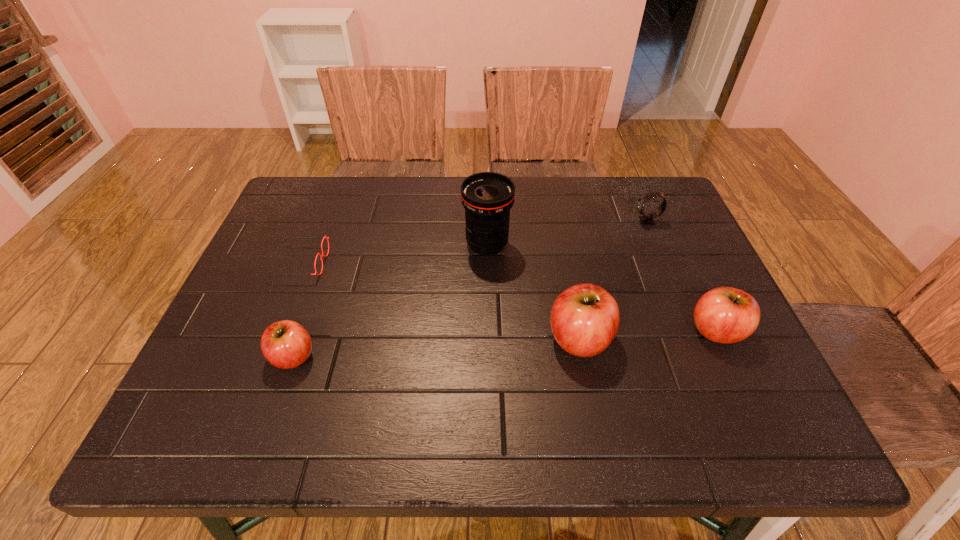
At what (x,y) coordinates should I click in order to perform the action: click on the leftmost apple. Please return your answer as a coordinate pair (x, y). The width and height of the screenshot is (960, 540). Looking at the image, I should click on (286, 344).

Locate an element on the screen. The width and height of the screenshot is (960, 540). the second apple from left to right is located at coordinates 584,320.

Identify the location of the tallest apple. [x=584, y=320].

You are a GUI agent. You are given a task and a screenshot of the screen. Output one action in this format:
    pyautogui.click(x=<x>, y=<y>)
    Task: Click on the second tallest apple
    
    Given the screenshot: What is the action you would take?
    pyautogui.click(x=726, y=315)

Where is `the rightmost apple`? The image size is (960, 540). the rightmost apple is located at coordinates (726, 315).

Where is `the farthest object`? the farthest object is located at coordinates (647, 219).

The image size is (960, 540). What are the coordinates of `spectacles` in the screenshot? It's located at [324, 236].

The height and width of the screenshot is (540, 960). I want to click on the tallest object, so click(x=487, y=197).

The image size is (960, 540). Find the location of `telephoto lens`. telephoto lens is located at coordinates (487, 197).

This screenshot has width=960, height=540. I want to click on blank area located on the back of the leftmost apple, so click(x=337, y=231).